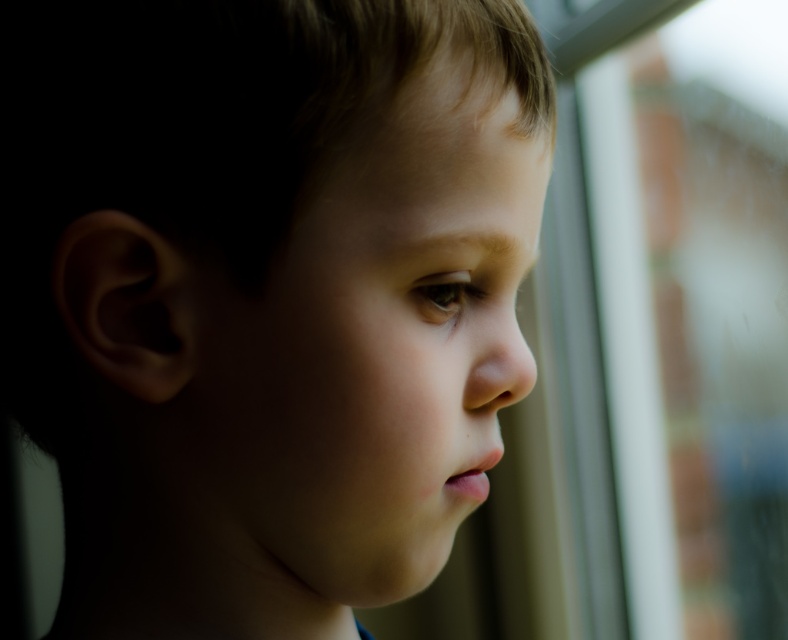
Question: Which object appears closest to the camera in this image?

Choices:
 (A) smooth skin child at upper center
 (B) transparent glass window at right

Answer: (A)

Question: Is smooth skin child at upper center below transparent glass window at right?

Choices:
 (A) yes
 (B) no

Answer: (A)

Question: Can you confirm if smooth skin child at upper center is wider than transparent glass window at right?

Choices:
 (A) no
 (B) yes

Answer: (A)

Question: Which of the following is the farthest from the observer?

Choices:
 (A) transparent glass window at right
 (B) smooth skin child at upper center

Answer: (A)

Question: Does smooth skin child at upper center have a larger size compared to transparent glass window at right?

Choices:
 (A) no
 (B) yes

Answer: (A)

Question: Among these objects, which one is farthest from the camera?

Choices:
 (A) transparent glass window at right
 (B) smooth skin child at upper center

Answer: (A)